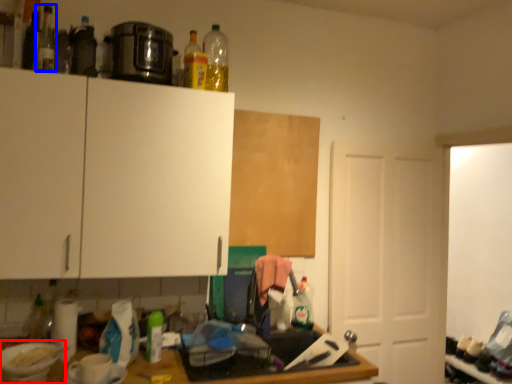
Question: Which point is closer to the camera, appliance (highlighted by a red box) or bottle (highlighted by a blue box)?

Choices:
 (A) appliance
 (B) bottle

Answer: (A)